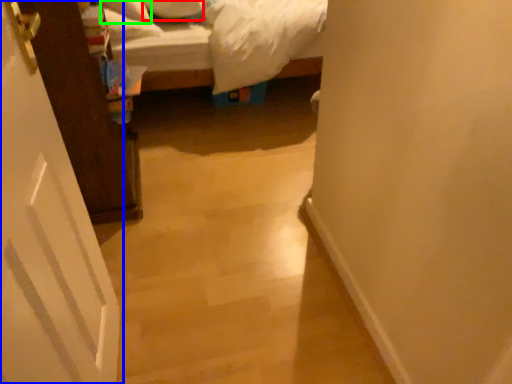
Question: Estimate the real-world distances between objects in this image. Which object is farther from pillow (highlighted by a red box), door (highlighted by a blue box) or pillow (highlighted by a green box)?

Choices:
 (A) door
 (B) pillow

Answer: (A)